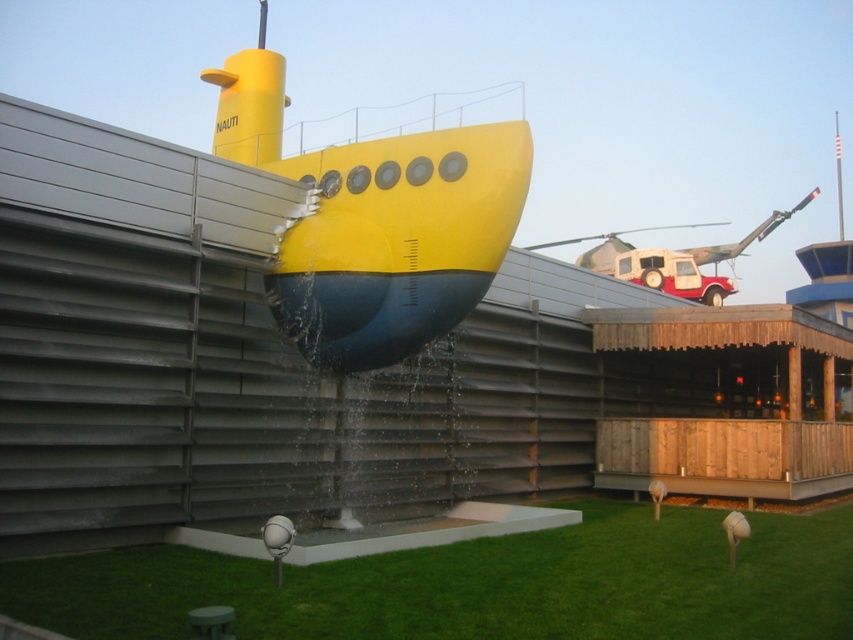
Question: Does green artificial turf at lower center have a larger size compared to yellow matte submarine at center?

Choices:
 (A) no
 (B) yes

Answer: (A)

Question: Does green artificial turf at lower center appear over yellow matte submarine at center?

Choices:
 (A) yes
 (B) no

Answer: (B)

Question: Is green artificial turf at lower center smaller than yellow matte submarine at center?

Choices:
 (A) yes
 (B) no

Answer: (A)

Question: Which of the following is the closest to the observer?

Choices:
 (A) green artificial turf at lower center
 (B) yellow matte submarine at center

Answer: (A)

Question: Which point appears closest to the camera in this image?

Choices:
 (A) (264, 138)
 (B) (171, 550)

Answer: (B)